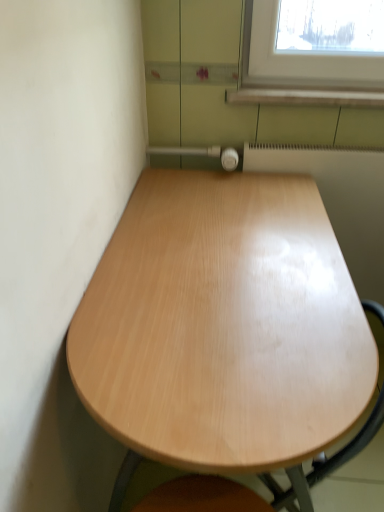
Question: Is light wood table at center at the back of white glossy radiator at upper right?

Choices:
 (A) no
 (B) yes

Answer: (A)

Question: Is white glossy radiator at upper right smaller than light wood table at center?

Choices:
 (A) no
 (B) yes

Answer: (B)

Question: Considering the relative sizes of white glossy radiator at upper right and light wood table at center in the image provided, is white glossy radiator at upper right thinner than light wood table at center?

Choices:
 (A) yes
 (B) no

Answer: (A)

Question: Is white glossy radiator at upper right not near light wood table at center?

Choices:
 (A) yes
 (B) no

Answer: (B)

Question: Considering the relative positions of white glossy radiator at upper right and light wood table at center in the image provided, is white glossy radiator at upper right behind light wood table at center?

Choices:
 (A) yes
 (B) no

Answer: (A)

Question: Considering the relative positions of white glossy radiator at upper right and light wood table at center in the image provided, is white glossy radiator at upper right to the right of light wood table at center from the viewer's perspective?

Choices:
 (A) yes
 (B) no

Answer: (A)

Question: Does light wood table at center turn towards white glossy radiator at upper right?

Choices:
 (A) yes
 (B) no

Answer: (B)

Question: Does light wood table at center come in front of white glossy radiator at upper right?

Choices:
 (A) no
 (B) yes

Answer: (B)

Question: From a real-world perspective, is light wood table at center located beneath white glossy radiator at upper right?

Choices:
 (A) yes
 (B) no

Answer: (A)

Question: Does light wood table at center have a lesser width compared to white glossy radiator at upper right?

Choices:
 (A) yes
 (B) no

Answer: (B)

Question: Is light wood table at center not within white glossy radiator at upper right?

Choices:
 (A) yes
 (B) no

Answer: (A)

Question: From the image's perspective, is light wood table at center located beneath white glossy radiator at upper right?

Choices:
 (A) no
 (B) yes

Answer: (B)

Question: From a real-world perspective, relative to light wood table at center, is white glossy radiator at upper right vertically above or below?

Choices:
 (A) below
 (B) above

Answer: (B)